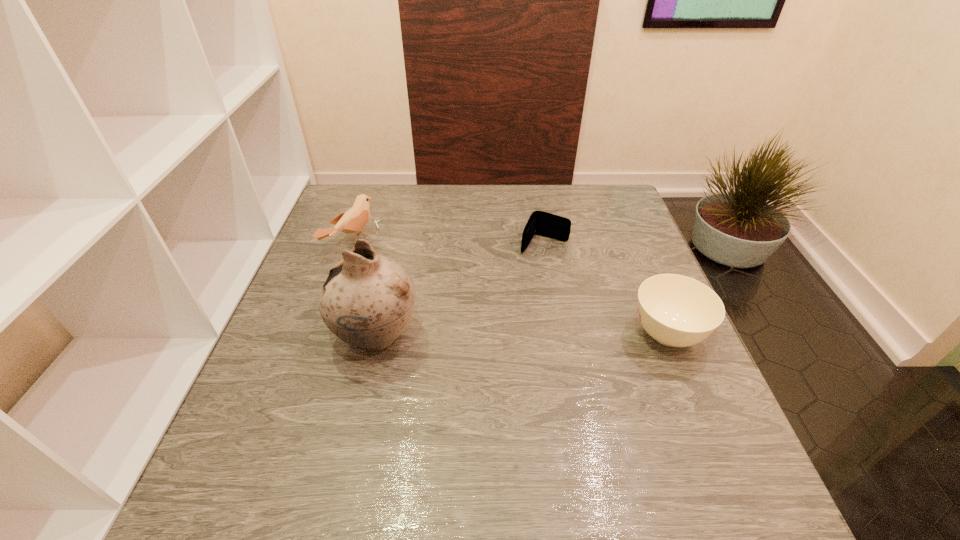
The width and height of the screenshot is (960, 540). Find the location of `free space at the far edge`. free space at the far edge is located at coordinates (460, 196).

Find the location of a particular element. The width and height of the screenshot is (960, 540). vacant region at the near edge is located at coordinates (486, 450).

You are a GUI agent. You are given a task and a screenshot of the screen. Output one action in this format:
    pyautogui.click(x=<x>, y=<y>)
    Task: Click on the free space at the left edge of the desktop
    The width and height of the screenshot is (960, 540).
    Given the screenshot: What is the action you would take?
    pyautogui.click(x=290, y=361)

Where is `vacant space at the right edge of the desktop`? The width and height of the screenshot is (960, 540). vacant space at the right edge of the desktop is located at coordinates (618, 255).

Find the location of a particular element. This screenshot has height=540, width=960. vacant space at the far left corner is located at coordinates (374, 205).

At what (x,y) coordinates should I click in order to perform the action: click on vacant position at the near left corner of the desktop. Please return your answer as a coordinate pair (x, y). The image size is (960, 540). Looking at the image, I should click on (317, 427).

This screenshot has width=960, height=540. I want to click on vacant region at the far right corner, so click(x=593, y=192).

This screenshot has width=960, height=540. In order to click on vacant space at the near right corner of the desktop in this screenshot , I will do `click(664, 415)`.

Locate an element on the screen. empty space between the bird and the rightmost object is located at coordinates (510, 288).

At what (x,y) coordinates should I click in order to perform the action: click on free area in between the second object from right to left and the bird. Please return your answer as a coordinate pair (x, y). Looking at the image, I should click on (448, 243).